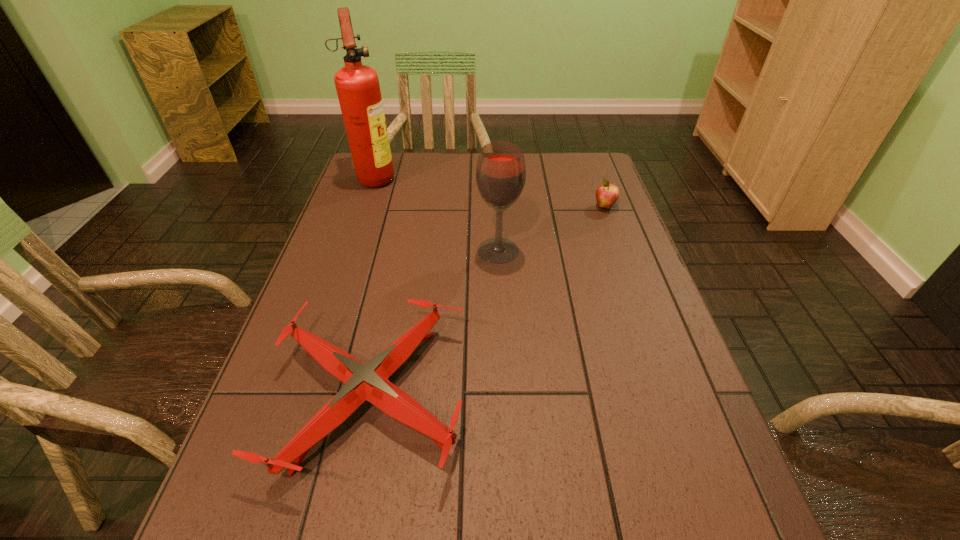
Find the location of a particular element. This screenshot has height=540, width=960. the farthest object is located at coordinates (358, 89).

Identify the location of the tallest object. (358, 89).

I want to click on alcohol, so click(x=501, y=171).

Where is `the second nearest object`? The width and height of the screenshot is (960, 540). the second nearest object is located at coordinates (501, 171).

The width and height of the screenshot is (960, 540). I want to click on the second farthest object, so (x=607, y=194).

What are the coordinates of `apple` in the screenshot? It's located at (607, 194).

Identify the location of drone. The width and height of the screenshot is (960, 540). pos(369,382).

The width and height of the screenshot is (960, 540). I want to click on the nearest object, so click(369, 382).

In order to click on blank space located 0.170m on the front-facing side of the fire extinguisher in this screenshot , I will do [447, 177].

Locate an element on the screen. The height and width of the screenshot is (540, 960). vacant space located on the back of the alcohol is located at coordinates (495, 197).